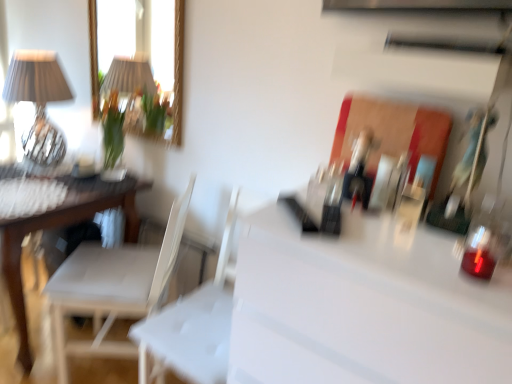
Question: Is matte glass table lamp at upper left completely or partially inside white plastic swivel chair at center?

Choices:
 (A) no
 (B) yes

Answer: (A)

Question: Is white plastic swivel chair at center further to the viewer compared to matte glass table lamp at upper left?

Choices:
 (A) no
 (B) yes

Answer: (A)

Question: Is white plastic swivel chair at center aimed at matte glass table lamp at upper left?

Choices:
 (A) no
 (B) yes

Answer: (A)

Question: Considering the relative sizes of white plastic swivel chair at center and matte glass table lamp at upper left in the image provided, is white plastic swivel chair at center thinner than matte glass table lamp at upper left?

Choices:
 (A) no
 (B) yes

Answer: (A)

Question: Is white plastic swivel chair at center facing away from matte glass table lamp at upper left?

Choices:
 (A) no
 (B) yes

Answer: (A)

Question: Is white plastic swivel chair at center inside or outside of white glossy counter top at center?

Choices:
 (A) outside
 (B) inside

Answer: (A)

Question: Considering the positions of white plastic swivel chair at center and white glossy counter top at center in the image, is white plastic swivel chair at center wider or thinner than white glossy counter top at center?

Choices:
 (A) wide
 (B) thin

Answer: (B)

Question: Looking at the image, does white plastic swivel chair at center seem bigger or smaller compared to white glossy counter top at center?

Choices:
 (A) big
 (B) small

Answer: (B)

Question: From the image's perspective, is white plastic swivel chair at center located above or below white glossy counter top at center?

Choices:
 (A) above
 (B) below

Answer: (A)

Question: From the image's perspective, relative to white plastic swivel chair at center, is white fabric chair at left above or below?

Choices:
 (A) below
 (B) above

Answer: (B)

Question: From their relative heights in the image, would you say white fabric chair at left is taller or shorter than white plastic swivel chair at center?

Choices:
 (A) short
 (B) tall

Answer: (A)

Question: Would you say white fabric chair at left is inside or outside white plastic swivel chair at center?

Choices:
 (A) inside
 (B) outside

Answer: (B)

Question: In terms of size, does white fabric chair at left appear bigger or smaller than white plastic swivel chair at center?

Choices:
 (A) small
 (B) big

Answer: (B)

Question: From the image's perspective, is white glossy counter top at center located above or below matte glass table lamp at upper left?

Choices:
 (A) above
 (B) below

Answer: (B)

Question: Based on their positions, is white glossy counter top at center located to the left or right of matte glass table lamp at upper left?

Choices:
 (A) left
 (B) right

Answer: (B)